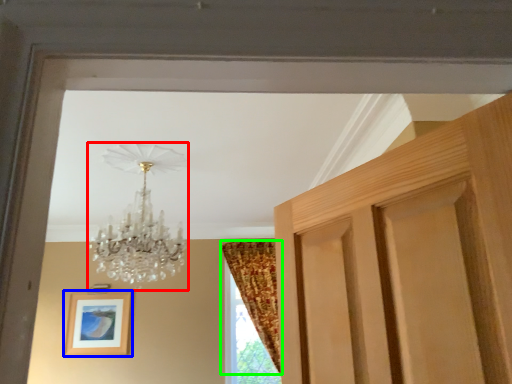
Question: Considering the real-world distances, which object is farthest from lamp (highlighted by a red box)? picture frame (highlighted by a blue box) or curtain (highlighted by a green box)?

Choices:
 (A) picture frame
 (B) curtain

Answer: (A)